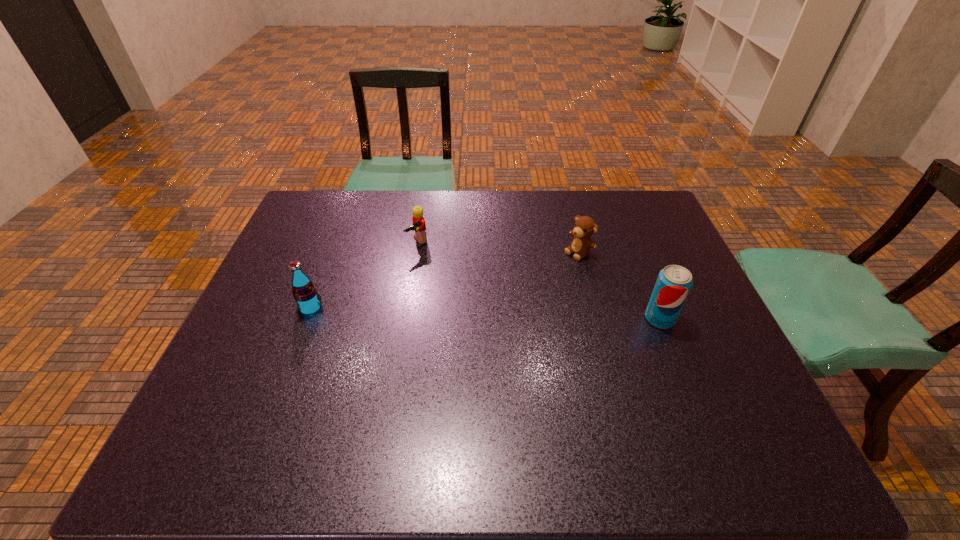
Image resolution: width=960 pixels, height=540 pixels. Identify the location of the left soda can. (304, 291).

The image size is (960, 540). I want to click on the right soda can, so click(x=674, y=282).

Where is `teddy bear`? The image size is (960, 540). teddy bear is located at coordinates (585, 226).

Locate an element on the screen. The height and width of the screenshot is (540, 960). the second object from left to right is located at coordinates (418, 225).

Locate an element on the screen. This screenshot has width=960, height=540. blank space located on the right of the left soda can is located at coordinates (401, 308).

The width and height of the screenshot is (960, 540). I want to click on vacant space located 0.080m on the front of the rightmost object, so click(675, 356).

I want to click on vacant space located 0.240m on the face of the third object from left to right, so [x=511, y=296].

You are a GUI agent. You are given a task and a screenshot of the screen. Output one action in this format:
    pyautogui.click(x=<x>, y=<y>)
    Task: Click on the free region located on the face of the third object from left to right
    The image size is (960, 540).
    Given the screenshot: What is the action you would take?
    pyautogui.click(x=537, y=279)

You are a GUI agent. You are given a task and a screenshot of the screen. Output one action in this format:
    pyautogui.click(x=<x>, y=<y>)
    Task: Click on the vacant space situated 0.340m on the face of the third object from left to right
    The height and width of the screenshot is (540, 960).
    Given the screenshot: What is the action you would take?
    pyautogui.click(x=483, y=314)

What are the coordinates of `vacant area situated 0.090m in front of the second object from left to right with the accessory visible` in the screenshot? It's located at (438, 268).